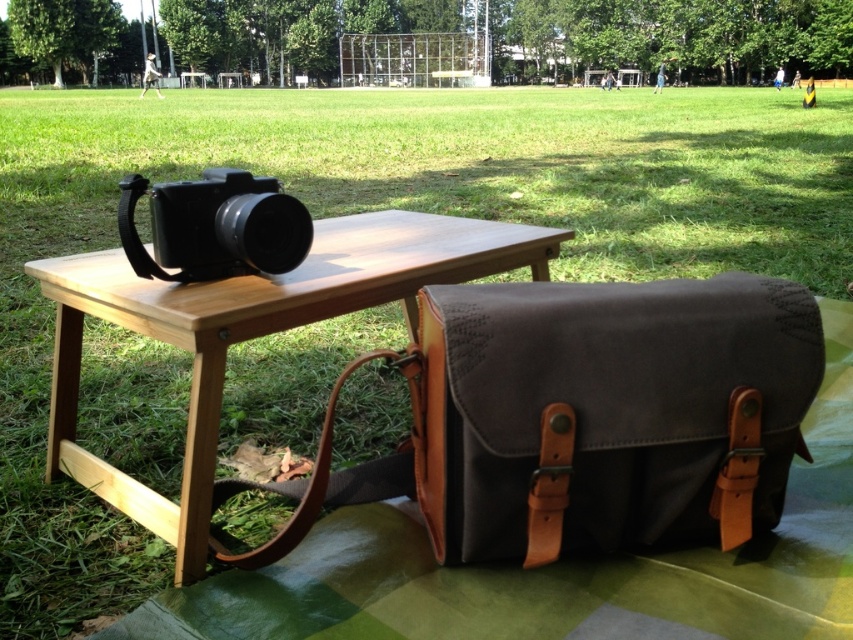
You are a photographer holding a 12 inch wide camera. You are standing at point (x=705, y=436) and want to place your camera on the picnic blanket. The camera must be placed so that its entire width fits within the blanket. Can you determine if the space between you and the blanket is wide enough?

The distance between you and the picnic blanket is 36.59 inches. Since your camera is only 12 inches wide, there is more than enough space to place it within the blanket.

You are a photographer who needs to quickly access your camera from the dark gray canvas bag at lower right while your camera is on the wooden table at center. Can you reach the camera without moving from your current position near the bag?

The distance between the dark gray canvas bag at lower right and the wooden table at center is 12.85 inches. Since this distance is relatively short, you can likely reach the camera without needing to move from near the bag.

You are setting up for a photo shoot in the park. You need to place your camera equipment on the wooden table at center. However, you also need to keep your dark gray canvas bag at lower right within easy reach. Based on their positions, which object is closer to the right side of the scene?

The dark gray canvas bag at lower right is to the right of the wooden table at center, so it is closer to the right side of the scene.